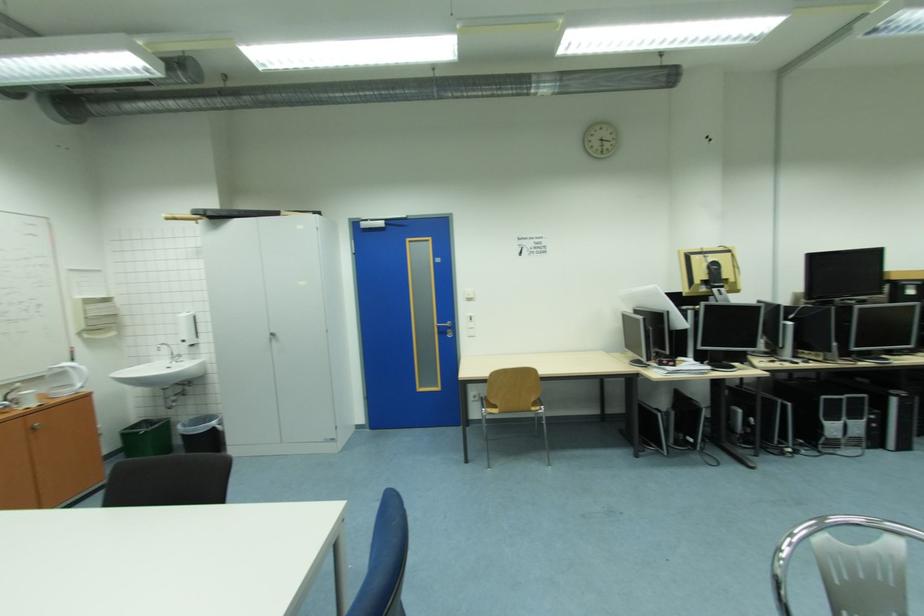
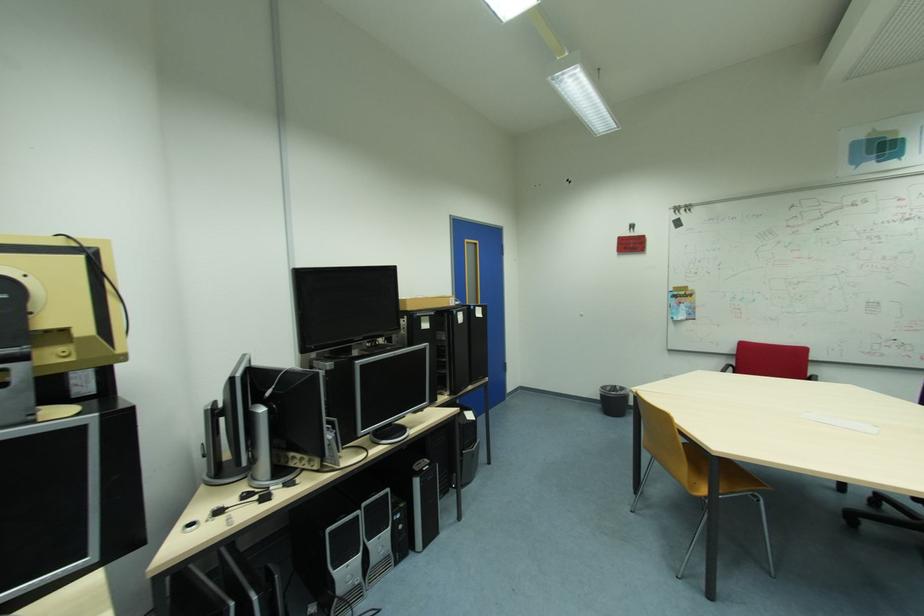
In the second image, find the point that corresponds to (x=731, y=249) in the first image.

(66, 244)